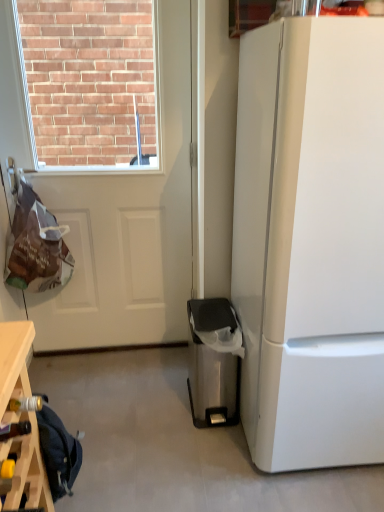
The height and width of the screenshot is (512, 384). In order to click on vacant space that is to the left of stainless steel trash can at lower right in this screenshot , I will do `click(157, 404)`.